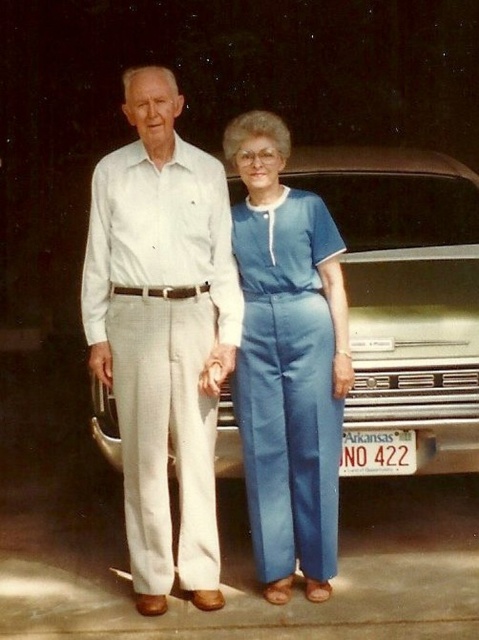
Question: In this image, where is metallic silver car at center located relative to blue cotton jumpsuit at center?

Choices:
 (A) right
 (B) left

Answer: (A)

Question: Is metallic silver car at center positioned behind white plastic arkansas license plate at center?

Choices:
 (A) yes
 (B) no

Answer: (B)

Question: Which of the following is the farthest from the observer?

Choices:
 (A) (376, 323)
 (B) (114, 218)

Answer: (A)

Question: Observing the image, what is the correct spatial positioning of white cotton pants at center in reference to white plastic arkansas license plate at center?

Choices:
 (A) above
 (B) below

Answer: (A)

Question: Which object is closer to the camera taking this photo?

Choices:
 (A) metallic silver car at center
 (B) white cotton pants at center

Answer: (B)

Question: Which object appears farthest from the camera in this image?

Choices:
 (A) blue cotton jumpsuit at center
 (B) white cotton pants at center

Answer: (A)